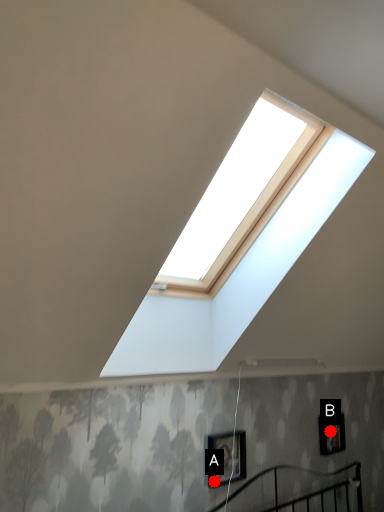
Question: Two points are circled on the image, labeled by A and B beside each circle. Which point is closer to the camera?

Choices:
 (A) A is closer
 (B) B is closer

Answer: (A)